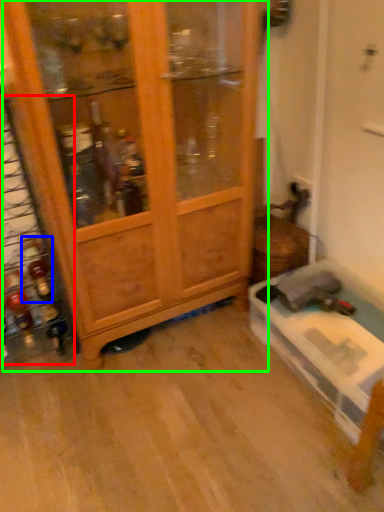
Question: Estimate the real-world distances between objects in this image. Which object is farther from shelf (highlighted by a red box), bottle (highlighted by a blue box) or cupboard (highlighted by a green box)?

Choices:
 (A) bottle
 (B) cupboard

Answer: (B)